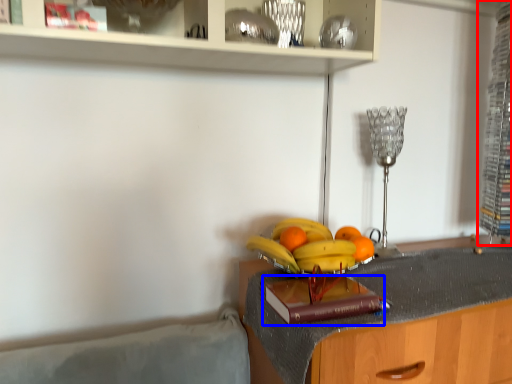
Question: Which point is further to the camera, cabinet (highlighted by a red box) or book (highlighted by a blue box)?

Choices:
 (A) cabinet
 (B) book

Answer: (A)